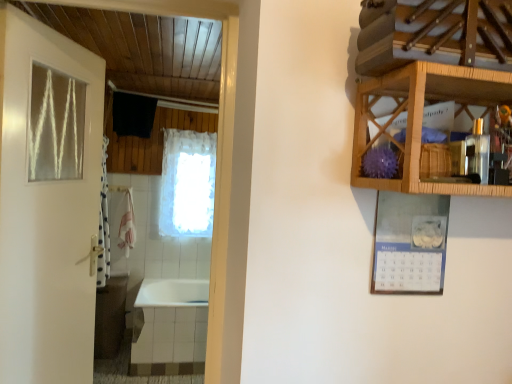
The height and width of the screenshot is (384, 512). In order to click on clear glass window at upper left in this screenshot , I will do `click(55, 126)`.

In order to face white paper calendar at upper right, should I rotate leftwards or rightwards?

You should look right and rotate roughly 20.404 degrees.

I want to click on white lace curtain at center, so click(187, 183).

From a real-world perspective, who is located lower, clear glass window at upper left or pink fabric towel at left?

pink fabric towel at left, from a real-world perspective.

Which point is more distant from viewer, (76, 143) or (121, 229)?

Point (121, 229)

Considering their positions, is clear glass window at upper left located in front of or behind pink fabric towel at left?

In the image, clear glass window at upper left appears in front of pink fabric towel at left.

Does wooden shelf at upper right have a smaller size compared to white glossy bathtub at lower left?

Yes, wooden shelf at upper right is smaller than white glossy bathtub at lower left.

Can you confirm if wooden shelf at upper right is thinner than white glossy bathtub at lower left?

Indeed, wooden shelf at upper right has a lesser width compared to white glossy bathtub at lower left.

Is point (447, 29) in front of point (188, 367)?

Yes, point (447, 29) is closer to viewer.

Between wooden shelf at upper right and white glossy bathtub at lower left, which one appears on the left side from the viewer's perspective?

From the viewer's perspective, white glossy bathtub at lower left appears more on the left side.

I want to click on door below the wooden shelf at upper right (from the image's perspective), so click(48, 202).

From the image's perspective, relative to white glossy door at left, is wooden shelf at upper right above or below?

Clearly, from the image's perspective, wooden shelf at upper right is above white glossy door at left.

Looking at this image, is wooden shelf at upper right wider or thinner than white glossy door at left?

wooden shelf at upper right is wider than white glossy door at left.

Considering their positions, is wooden shelf at upper right located in front of or behind white glossy door at left?

In the image, wooden shelf at upper right appears in front of white glossy door at left.

Which object is further away from the camera taking this photo, white lace curtain at center or wooden shelf at upper right?

white lace curtain at center is more distant.

Considering the relative sizes of white lace curtain at center and wooden shelf at upper right in the image provided, is white lace curtain at center taller than wooden shelf at upper right?

Indeed, white lace curtain at center has a greater height compared to wooden shelf at upper right.

Can you tell me how much white lace curtain at center and wooden shelf at upper right differ in facing direction?

The angle between the facing direction of white lace curtain at center and the facing direction of wooden shelf at upper right is 0.414 degrees.

Is white lace curtain at center thinner than wooden shelf at upper right?

Yes.

Looking at this image, are wooden cabinet at upper right and white glossy door at left beside each other?

No, wooden cabinet at upper right is not in contact with white glossy door at left.

Which object is thinner, wooden cabinet at upper right or white glossy door at left?

white glossy door at left.

Does wooden cabinet at upper right contain white glossy door at left?

Definitely not — white glossy door at left is not inside wooden cabinet at upper right.

Is point (426, 291) closer or farther from the camera than point (93, 173)?

Clearly, point (426, 291) is closer to the camera than point (93, 173).

Which of these two, white paper calendar at upper right or white glossy door at left, is thinner?

Thinner between the two is white paper calendar at upper right.

Is white paper calendar at upper right to the left or to the right of white glossy door at left in the image?

From the image, it's evident that white paper calendar at upper right is to the right of white glossy door at left.

Who is taller, white paper calendar at upper right or white glossy door at left?

white glossy door at left is taller.

In terms of height, does wooden cabinet at upper right look taller or shorter compared to pink fabric towel at left?

Clearly, wooden cabinet at upper right is shorter compared to pink fabric towel at left.

From a real-world perspective, between wooden cabinet at upper right and pink fabric towel at left, who is vertically higher?

In real-world perspective, wooden cabinet at upper right is above.

Is wooden cabinet at upper right oriented towards pink fabric towel at left?

No, wooden cabinet at upper right does not turn towards pink fabric towel at left.

Is point (416, 109) positioned behind point (133, 209)?

No, it is not.

At what (x,y) coordinates should I click in order to perform the action: click on towel/napkin behind the clear glass window at upper left. Please return your answer as a coordinate pair (x, y). The height and width of the screenshot is (384, 512). Looking at the image, I should click on (127, 223).

I want to click on shelf on the right side of white glossy bathtub at lower left, so coord(434,34).

Which object lies nearer to the anchor point white glossy door at left, clear glass window at upper left or white paper calendar at upper right?

clear glass window at upper left is positioned closer to the anchor white glossy door at left.

Looking at this image, from the image, which object appears to be nearer to white paper calendar at upper right, wooden cabinet at upper right or wooden shelf at upper right?

Based on the image, wooden cabinet at upper right appears to be nearer to white paper calendar at upper right.

Looking at the image, which one is located further to white glossy bathtub at lower left, white glossy door at left or pink fabric towel at left?

white glossy door at left lies further to white glossy bathtub at lower left than the other object.

Estimate the real-world distances between objects in this image. Which object is further from wooden cabinet at upper right, wooden shelf at upper right or pink fabric towel at left?

pink fabric towel at left is positioned further to the anchor wooden cabinet at upper right.

Which object lies nearer to the anchor point wooden cabinet at upper right, white paper calendar at upper right or white lace curtain at center?

white paper calendar at upper right is positioned closer to the anchor wooden cabinet at upper right.

Looking at the image, which one is located further to white lace curtain at center, clear glass window at upper left or white glossy door at left?

Based on the image, clear glass window at upper left appears to be further to white lace curtain at center.

Looking at the image, which one is located further to white glossy door at left, wooden shelf at upper right or wooden cabinet at upper right?

Based on the image, wooden shelf at upper right appears to be further to white glossy door at left.

Looking at this image, estimate the real-world distances between objects in this image. Which object is further from white paper calendar at upper right, clear glass window at upper left or pink fabric towel at left?

Based on the image, pink fabric towel at left appears to be further to white paper calendar at upper right.

The height and width of the screenshot is (384, 512). I want to click on picture frame between wooden cabinet at upper right and white glossy bathtub at lower left in the front-back direction, so click(410, 243).

You are a GUI agent. You are given a task and a screenshot of the screen. Output one action in this format:
    pyautogui.click(x=<x>, y=<y>)
    Task: Click on the cabinetry between wooden shelf at upper right and white glossy bathtub at lower left along the z-axis
    The image size is (512, 384).
    Given the screenshot: What is the action you would take?
    pyautogui.click(x=422, y=118)

Find the location of a particular element. The width and height of the screenshot is (512, 384). picture frame between clear glass window at upper left and wooden cabinet at upper right is located at coordinates (410, 243).

Where is `picture frame between wooden shelf at upper right and white lace curtain at center along the z-axis`? Image resolution: width=512 pixels, height=384 pixels. picture frame between wooden shelf at upper right and white lace curtain at center along the z-axis is located at coordinates (410, 243).